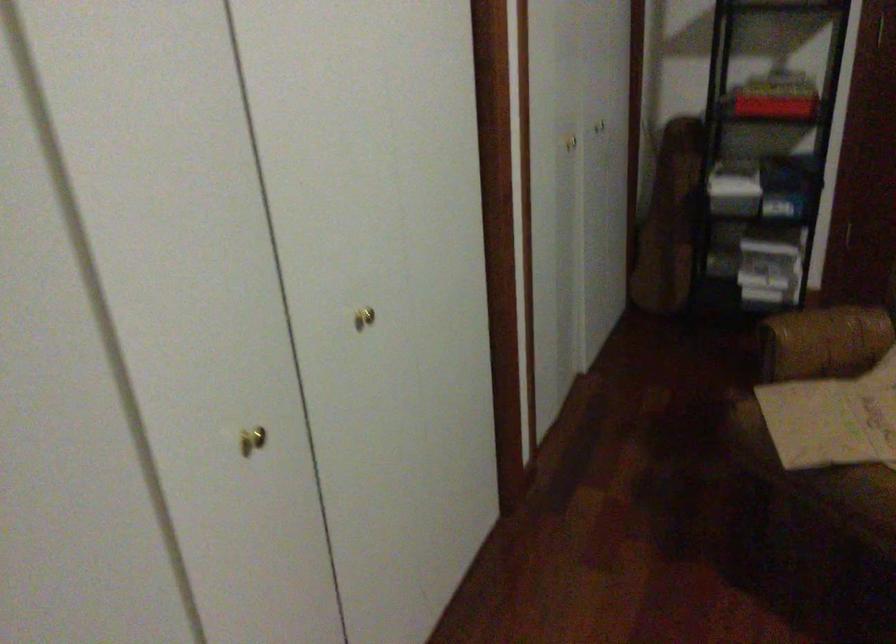
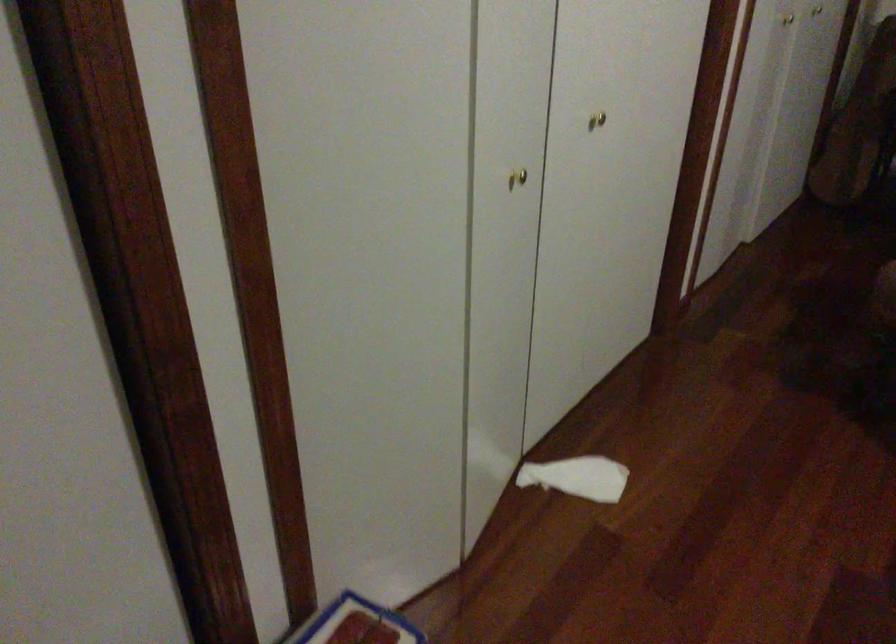
Question: The first image is from the beginning of the video and the second image is from the end. How did the camera likely rotate when shooting the video?

Choices:
 (A) Left
 (B) Right
 (C) Up
 (D) Down

Answer: (A)